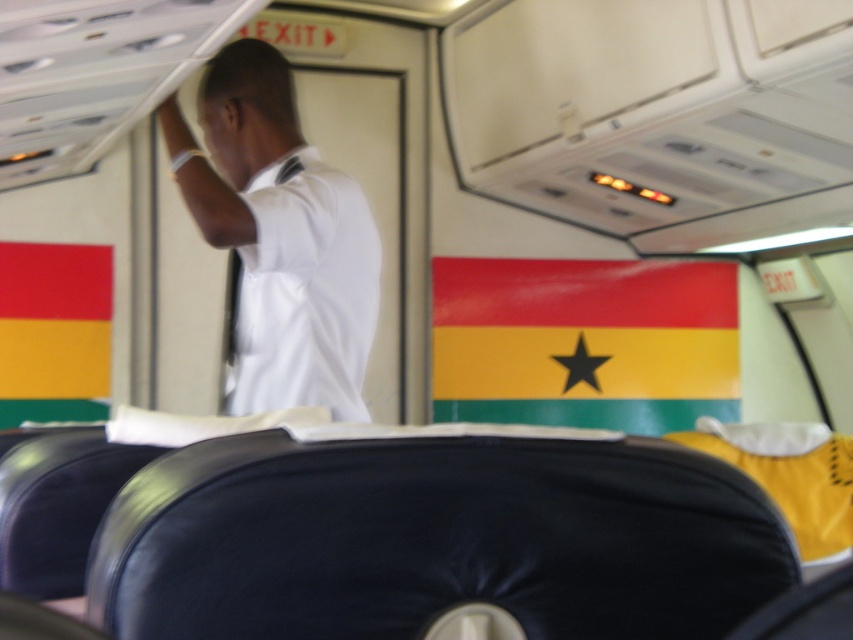
You are a passenger sitting in the seat in the foreground of the airplane cabin. You notice the white shirt at upper center and the shiny plastic flag at center. Which object is nearer to you?

The white shirt at upper center is closer to the viewer than the shiny plastic flag at center, so the white shirt at upper center is nearer to you.

You are a passenger sitting in the airplane cabin and looking around. You notice the white shirt at upper center and the shiny plastic flag at center. Which object is shorter?

The white shirt at upper center is shorter than the shiny plastic flag at center.